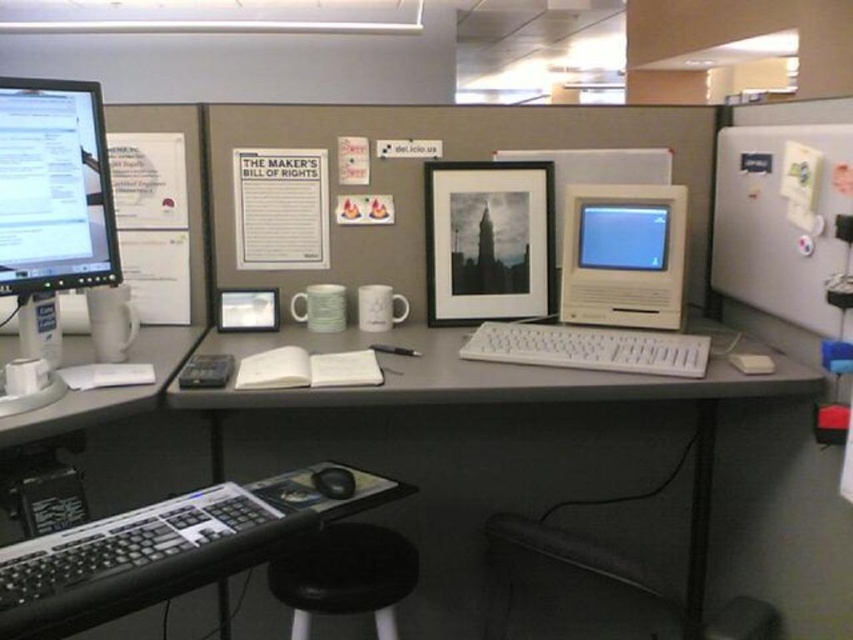
Can you confirm if black leather stool at lower center is smaller than black rubber mouse at lower center?

Incorrect, black leather stool at lower center is not smaller in size than black rubber mouse at lower center.

From the picture: Does black leather stool at lower center have a greater height compared to black rubber mouse at lower center?

Indeed, black leather stool at lower center has a greater height compared to black rubber mouse at lower center.

You are a GUI agent. You are given a task and a screenshot of the screen. Output one action in this format:
    pyautogui.click(x=<x>, y=<y>)
    Task: Click on the black leather stool at lower center
    The height and width of the screenshot is (640, 853).
    Given the screenshot: What is the action you would take?
    pyautogui.click(x=345, y=576)

I want to click on black leather stool at lower center, so click(x=345, y=576).

The height and width of the screenshot is (640, 853). Find the location of `white plastic computer at center`. white plastic computer at center is located at coordinates (611, 289).

Between point (691, 348) and point (670, 612), which one is positioned behind?

The point (670, 612) is behind.

At what (x,y) coordinates should I click in order to perform the action: click on white plastic computer at center. Please return your answer as a coordinate pair (x, y). The height and width of the screenshot is (640, 853). Looking at the image, I should click on (611, 289).

Does matte black monitor at upper left have a lesser height compared to white plastic keyboard at center?

No.

Does point (74, 164) come in front of point (631, 365)?

Yes, point (74, 164) is in front of point (631, 365).

Where is `matte black monitor at upper left`? matte black monitor at upper left is located at coordinates (54, 188).